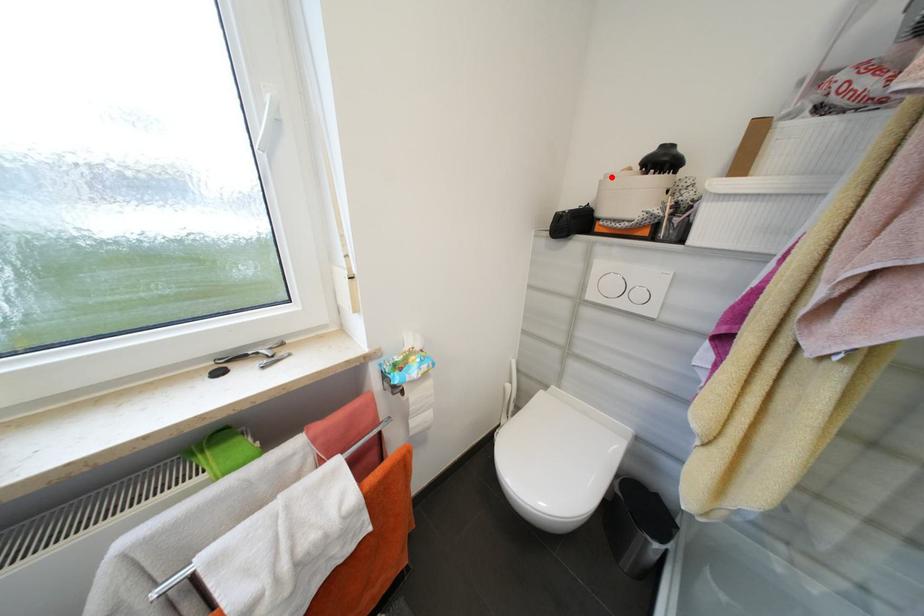
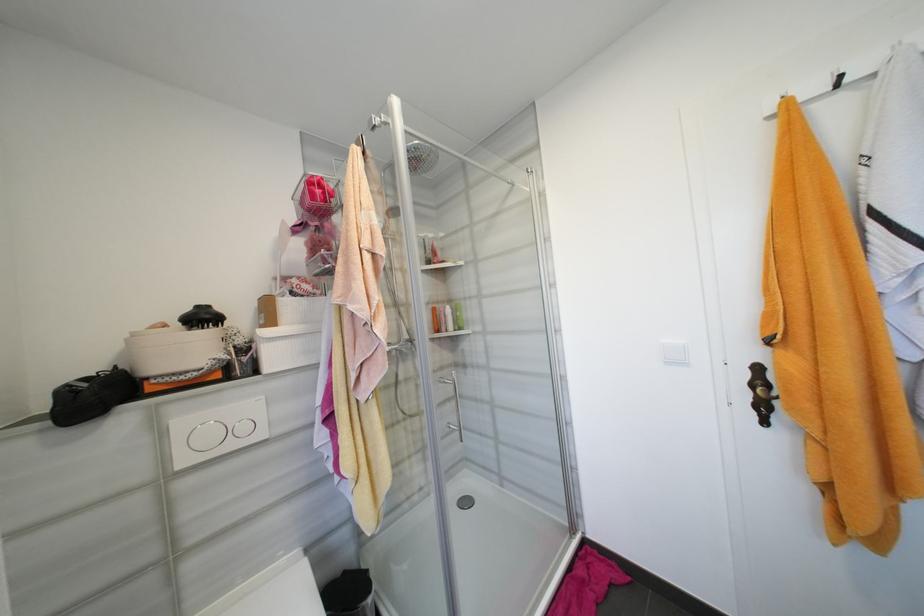
Locate, in the second image, the point that corresponds to the highlighted location in the first image.

(140, 334)